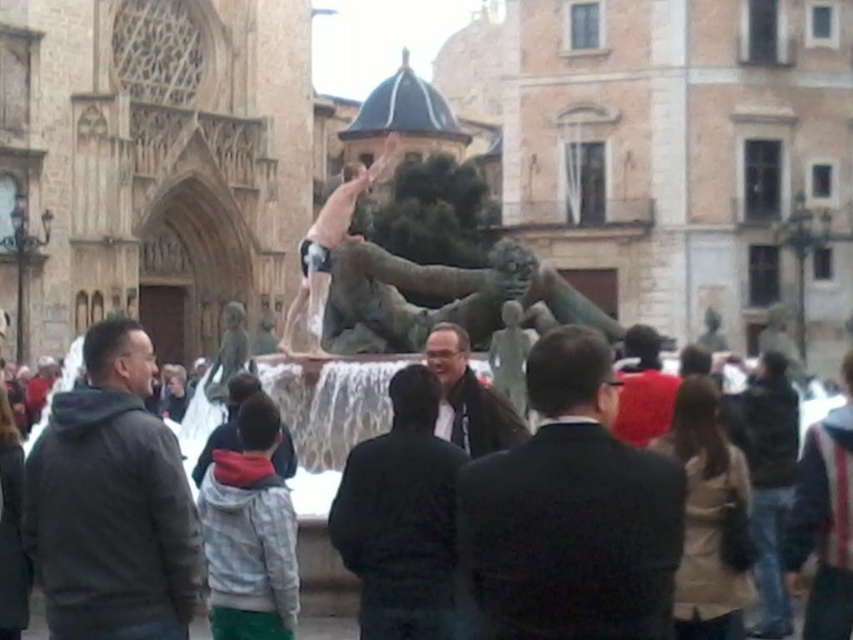
Question: Which object appears closest to the camera in this image?

Choices:
 (A) bronze statue at center
 (B) dark brown suit at center

Answer: (B)

Question: Can you confirm if dark brown suit at center is positioned above dark gray hoodie at center?

Choices:
 (A) no
 (B) yes

Answer: (A)

Question: Among these points, which one is farthest from the camera?

Choices:
 (A) (189, 560)
 (B) (461, 460)

Answer: (B)

Question: Does dark gray hoodie at center appear on the right side of dark gray jacket at center?

Choices:
 (A) yes
 (B) no

Answer: (B)

Question: Based on their relative distances, which object is farther from the dark gray suit at center?

Choices:
 (A) dark gray hoodie at center
 (B) matte gray statue at center
 (C) dark gray jacket at center
 (D) dark brown suit at center

Answer: (B)

Question: Does matte gray statue at center appear under dark gray suit at center?

Choices:
 (A) yes
 (B) no

Answer: (A)